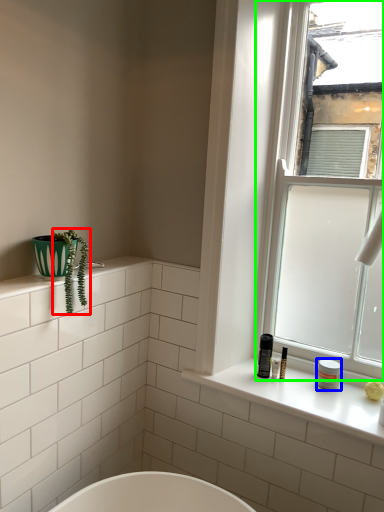
Question: Which object is the farthest from plant (highlighted by a red box)? Choose among these: toiletry (highlighted by a blue box) or window (highlighted by a green box).

Choices:
 (A) toiletry
 (B) window

Answer: (B)